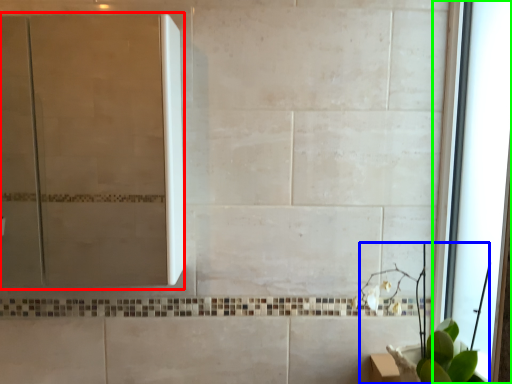
Question: Which object is positioned closest to screen door (highlighted by a red box)? Select from plant (highlighted by a blue box) and window (highlighted by a green box).

Choices:
 (A) plant
 (B) window

Answer: (B)